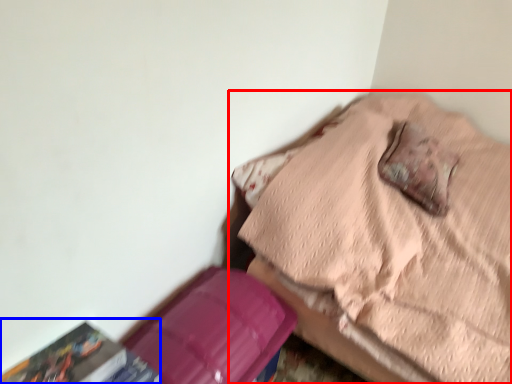
Question: Among these objects, which one is farthest to the camera, furniture (highlighted by a red box) or paperback book (highlighted by a blue box)?

Choices:
 (A) furniture
 (B) paperback book

Answer: (A)